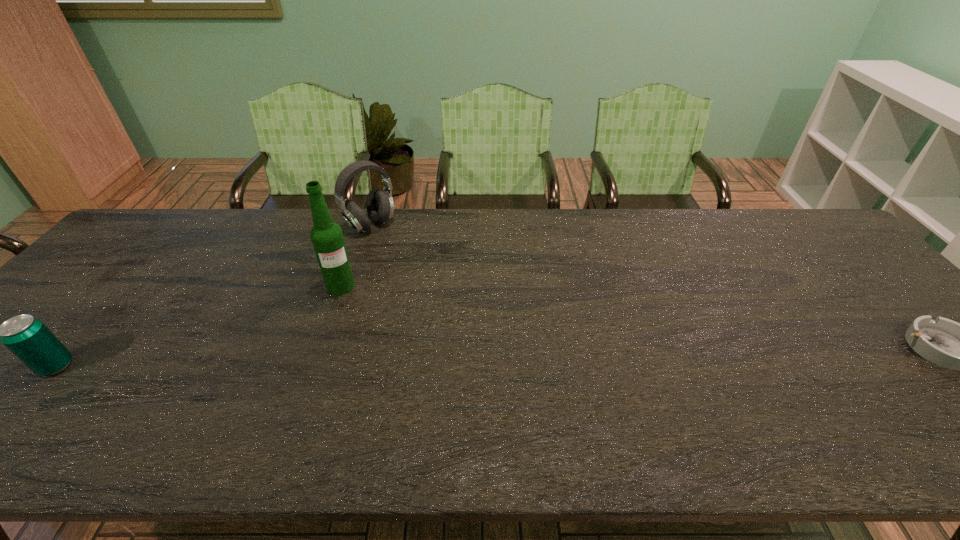
I want to click on free space at the near left corner, so click(x=47, y=395).

In the image, there is a desktop. At what (x,y) coordinates should I click in order to perform the action: click on vacant space at the far right corner. Please return your answer as a coordinate pair (x, y). Looking at the image, I should click on (824, 237).

Identify the location of free spot between the beer bottle and the second tallest object. (356, 256).

Locate an element on the screen. This screenshot has width=960, height=540. blank region between the third tallest object and the second tallest object is located at coordinates (214, 295).

Locate an element on the screen. The image size is (960, 540). vacant space that's between the leftmost object and the farthest object is located at coordinates (214, 295).

In order to click on vacant area that lies between the beer bottle and the farthest object in this screenshot , I will do `click(356, 256)`.

I want to click on free point between the third nearest object and the beer can, so click(199, 326).

You are a GUI agent. You are given a task and a screenshot of the screen. Output one action in this format:
    pyautogui.click(x=<x>, y=<y>)
    Task: Click on the blank region between the third shortest object and the beer can
    This screenshot has width=960, height=540.
    Given the screenshot: What is the action you would take?
    pyautogui.click(x=214, y=295)

This screenshot has height=540, width=960. What are the coordinates of `vacant space that's between the second tallest object and the beer bottle` in the screenshot? It's located at (356, 256).

The height and width of the screenshot is (540, 960). In order to click on the second closest object relative to the headset in this screenshot , I will do `click(29, 339)`.